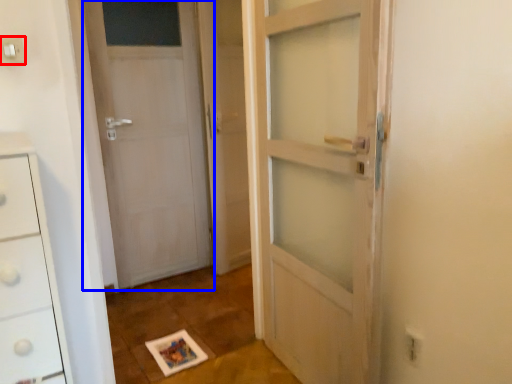
Question: Which point is closer to the camera, electric outlet (highlighted by a red box) or door (highlighted by a blue box)?

Choices:
 (A) electric outlet
 (B) door

Answer: (A)